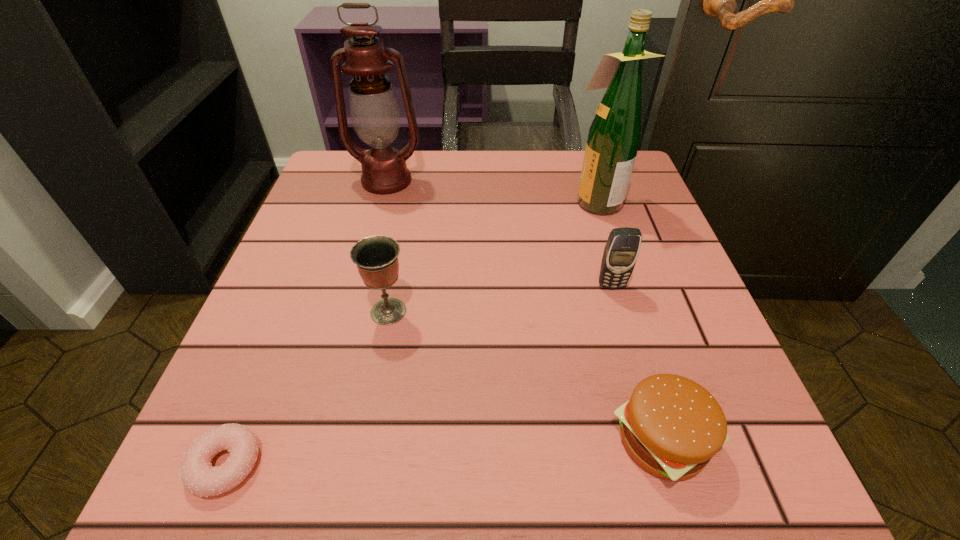
I want to click on liquor, so click(614, 136).

In order to click on oil lamp in this screenshot , I will do `click(374, 110)`.

Where is `the fourth farthest object`? the fourth farthest object is located at coordinates (376, 257).

Find the location of a particular element. The height and width of the screenshot is (540, 960). the third farthest object is located at coordinates (621, 251).

I want to click on hamburger, so click(671, 426).

Identify the location of doughnut. (198, 476).

Image resolution: width=960 pixels, height=540 pixels. What are the coordinates of `vacant point located on the front-facing side of the liquor` in the screenshot? It's located at (543, 200).

The image size is (960, 540). I want to click on free space located on the front-facing side of the liquor, so click(543, 200).

Locate an element on the screen. vacant space positioned 0.220m on the front-facing side of the liquor is located at coordinates (470, 200).

Locate an element on the screen. The image size is (960, 540). free space located on the front of the oil lamp is located at coordinates (362, 271).